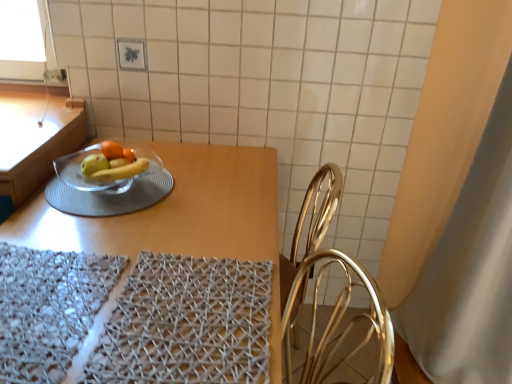
The image size is (512, 384). What do you see at coordinates (48, 308) in the screenshot?
I see `woven fabric place mat at lower left, which is the second place mat in right-to-left order` at bounding box center [48, 308].

This screenshot has height=384, width=512. In order to click on transparent glass bowl at center in this screenshot , I will do `click(106, 185)`.

In order to click on wooden table at center in this screenshot , I will do `click(181, 217)`.

Locate an element on the screen. woven fabric place mat at lower center, the 1th place mat when ordered from right to left is located at coordinates (187, 323).

What do you see at coordinates (457, 204) in the screenshot?
I see `white fabric curtain at right` at bounding box center [457, 204].

Image resolution: width=512 pixels, height=384 pixels. I want to click on woven fabric place mat at lower left, which is the second place mat in right-to-left order, so click(x=48, y=308).

Is there a large distance between transparent glass bowl at center and woven fabric place mat at lower center, acting as the second place mat starting from the left?

Actually, transparent glass bowl at center and woven fabric place mat at lower center, acting as the second place mat starting from the left, are a little close together.

Image resolution: width=512 pixels, height=384 pixels. What are the coordinates of `the 1st place mat in front when counting from the transparent glass bowl at center` in the screenshot? It's located at (187, 323).

Is transparent glass bowl at center thinner than woven fabric place mat at lower center, acting as the second place mat starting from the left?

In fact, transparent glass bowl at center might be wider than woven fabric place mat at lower center, acting as the second place mat starting from the left.

Based on the photo, is transparent glass bowl at center outside of woven fabric place mat at lower center, the 1th place mat when ordered from right to left?

Yes, transparent glass bowl at center is located beyond the bounds of woven fabric place mat at lower center, the 1th place mat when ordered from right to left.

From the image's perspective, which object appears higher, wooden table at center or woven fabric place mat at lower left, which is the first place mat from left to right?

From the image's view, woven fabric place mat at lower left, which is the first place mat from left to right, is above.

Could you measure the distance between wooden table at center and woven fabric place mat at lower left, which is the second place mat in right-to-left order?

wooden table at center is 28.19 centimeters from woven fabric place mat at lower left, which is the second place mat in right-to-left order.

Who is more distant, wooden table at center or woven fabric place mat at lower left, which is the first place mat from left to right?

wooden table at center is more distant.

Is the surface of wooden table at center in direct contact with woven fabric place mat at lower left, which is the first place mat from left to right?

No, wooden table at center is not making contact with woven fabric place mat at lower left, which is the first place mat from left to right.

Considering the points (453, 130) and (156, 186), which point is in front, point (453, 130) or point (156, 186)?

Positioned in front is point (156, 186).

Can you tell me how much white fabric curtain at right and transparent glass bowl at center differ in facing direction?

The facing directions of white fabric curtain at right and transparent glass bowl at center are 3.11 degrees apart.

From the picture: Is white fabric curtain at right positioned behind transparent glass bowl at center?

That is False.

Is white fabric curtain at right next to transparent glass bowl at center and touching it?

white fabric curtain at right and transparent glass bowl at center are clearly separated.

In the scene shown: Could you measure the distance between woven fabric place mat at lower left, which is the second place mat in right-to-left order, and transparent glass bowl at center?

The distance of woven fabric place mat at lower left, which is the second place mat in right-to-left order, from transparent glass bowl at center is 13.47 inches.

In terms of size, does woven fabric place mat at lower left, which is the first place mat from left to right, appear bigger or smaller than transparent glass bowl at center?

woven fabric place mat at lower left, which is the first place mat from left to right, is bigger than transparent glass bowl at center.

In the scene shown: Is woven fabric place mat at lower left, which is the second place mat in right-to-left order, looking in the opposite direction of transparent glass bowl at center?

No, woven fabric place mat at lower left, which is the second place mat in right-to-left order, is not facing the opposite direction of transparent glass bowl at center.

From a real-world perspective, which is physically above, woven fabric place mat at lower left, which is the second place mat in right-to-left order, or transparent glass bowl at center?

woven fabric place mat at lower left, which is the second place mat in right-to-left order, is physically above.

Locate an element on the screen. The width and height of the screenshot is (512, 384). curtain behind the woven fabric place mat at lower center, acting as the second place mat starting from the left is located at coordinates (457, 204).

Considering the sizes of white fabric curtain at right and woven fabric place mat at lower center, acting as the second place mat starting from the left, in the image, is white fabric curtain at right bigger or smaller than woven fabric place mat at lower center, acting as the second place mat starting from the left,?

In the image, white fabric curtain at right appears to be larger than woven fabric place mat at lower center, acting as the second place mat starting from the left.

Which of these two, transparent glass bowl at center or white fabric curtain at right, stands taller?

white fabric curtain at right.

From a real-world perspective, is transparent glass bowl at center positioned above or below white fabric curtain at right?

From a real-world perspective, transparent glass bowl at center is physically above white fabric curtain at right.

How far apart are transparent glass bowl at center and white fabric curtain at right?

transparent glass bowl at center and white fabric curtain at right are 1.08 meters apart.

Considering the positions of points (122, 182) and (500, 234), is point (122, 182) closer to camera compared to point (500, 234)?

Yes, point (122, 182) is closer to viewer.

From a real-world perspective, relative to woven fabric place mat at lower left, which is the second place mat in right-to-left order, is woven fabric place mat at lower center, acting as the second place mat starting from the left, vertically above or below?

In terms of real-world spatial position, woven fabric place mat at lower center, acting as the second place mat starting from the left, is above woven fabric place mat at lower left, which is the second place mat in right-to-left order.

Between woven fabric place mat at lower center, acting as the second place mat starting from the left, and woven fabric place mat at lower left, which is the first place mat from left to right, which one has smaller size?

With smaller size is woven fabric place mat at lower center, acting as the second place mat starting from the left.

Which is less distant, (x=150, y=300) or (x=51, y=360)?

Positioned in front is point (x=51, y=360).

From the image's perspective, is woven fabric place mat at lower center, acting as the second place mat starting from the left, over woven fabric place mat at lower left, which is the first place mat from left to right?

No, from the image's perspective, woven fabric place mat at lower center, acting as the second place mat starting from the left, is not on top of woven fabric place mat at lower left, which is the first place mat from left to right.

Find the location of `tableware lying on the left of woven fabric place mat at lower center, acting as the second place mat starting from the left`. tableware lying on the left of woven fabric place mat at lower center, acting as the second place mat starting from the left is located at coordinates (106, 185).

This screenshot has width=512, height=384. I want to click on table located on the right of woven fabric place mat at lower left, which is the second place mat in right-to-left order, so click(181, 217).

Based on their spatial positions, is woven fabric place mat at lower center, the 1th place mat when ordered from right to left, or woven fabric place mat at lower left, which is the first place mat from left to right, further from white fabric curtain at right?

Based on the image, woven fabric place mat at lower left, which is the first place mat from left to right, appears to be further to white fabric curtain at right.

From the image, which object appears to be farther from transparent glass bowl at center, white fabric curtain at right or woven fabric place mat at lower left, which is the second place mat in right-to-left order?

white fabric curtain at right.

When comparing their distances from woven fabric place mat at lower left, which is the first place mat from left to right, does transparent glass bowl at center or woven fabric place mat at lower center, the 1th place mat when ordered from right to left, seem further?

transparent glass bowl at center lies further to woven fabric place mat at lower left, which is the first place mat from left to right, than the other object.

Looking at the image, which one is located further to white fabric curtain at right, wooden table at center or transparent glass bowl at center?

transparent glass bowl at center lies further to white fabric curtain at right than the other object.

When comparing their distances from woven fabric place mat at lower center, the 1th place mat when ordered from right to left, does transparent glass bowl at center or woven fabric place mat at lower left, which is the first place mat from left to right, seem closer?

The object closer to woven fabric place mat at lower center, the 1th place mat when ordered from right to left, is woven fabric place mat at lower left, which is the first place mat from left to right.

Based on the photo, from the image, which object appears to be farther from wooden table at center, white fabric curtain at right or woven fabric place mat at lower center, the 1th place mat when ordered from right to left?

Based on the image, white fabric curtain at right appears to be further to wooden table at center.

Based on the photo, considering their positions, is transparent glass bowl at center positioned closer to white fabric curtain at right than wooden table at center?

wooden table at center lies closer to white fabric curtain at right than the other object.

Based on their spatial positions, is wooden table at center or woven fabric place mat at lower left, which is the second place mat in right-to-left order, closer to woven fabric place mat at lower center, the 1th place mat when ordered from right to left?

woven fabric place mat at lower left, which is the second place mat in right-to-left order, is closer to woven fabric place mat at lower center, the 1th place mat when ordered from right to left.

Identify the location of place mat between transparent glass bowl at center and white fabric curtain at right. (187, 323).

Identify the location of table located between woven fabric place mat at lower left, which is the first place mat from left to right, and woven fabric place mat at lower center, acting as the second place mat starting from the left, in the left-right direction. (181, 217).

Identify the location of table situated between transparent glass bowl at center and white fabric curtain at right from left to right. (181, 217).

Where is `tableware between woven fabric place mat at lower left, which is the first place mat from left to right, and white fabric curtain at right, in the horizontal direction`? This screenshot has width=512, height=384. tableware between woven fabric place mat at lower left, which is the first place mat from left to right, and white fabric curtain at right, in the horizontal direction is located at coordinates (106, 185).